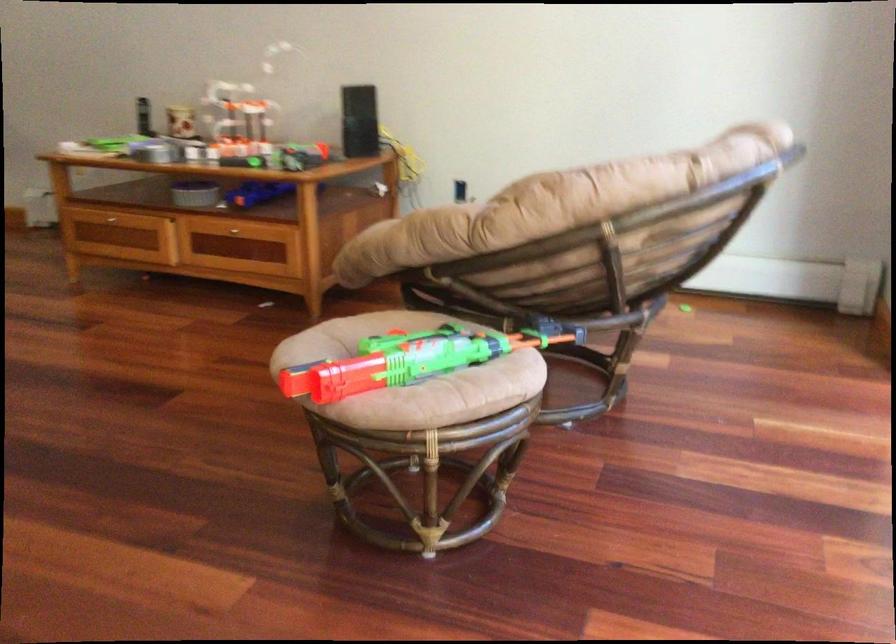
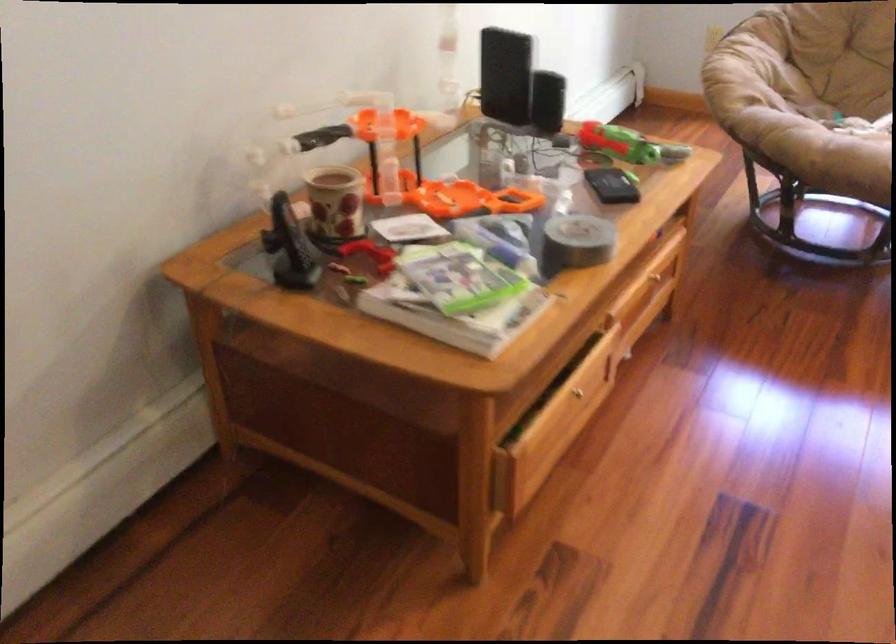
Locate, in the second image, the point that corresponds to (148,149) in the first image.

(576, 242)